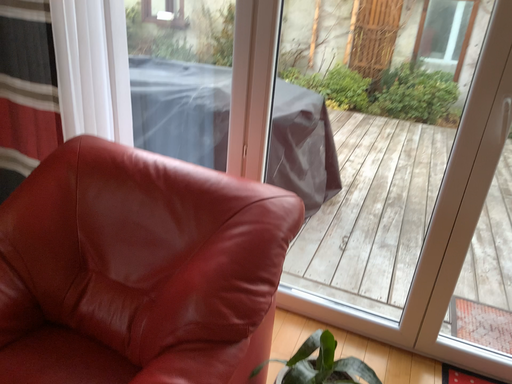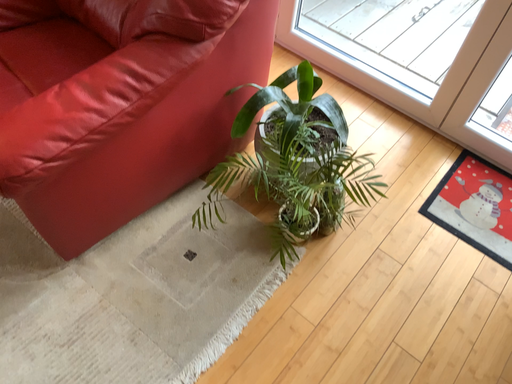
Question: Which way did the camera rotate in the video?

Choices:
 (A) rotated upward
 (B) rotated downward

Answer: (B)